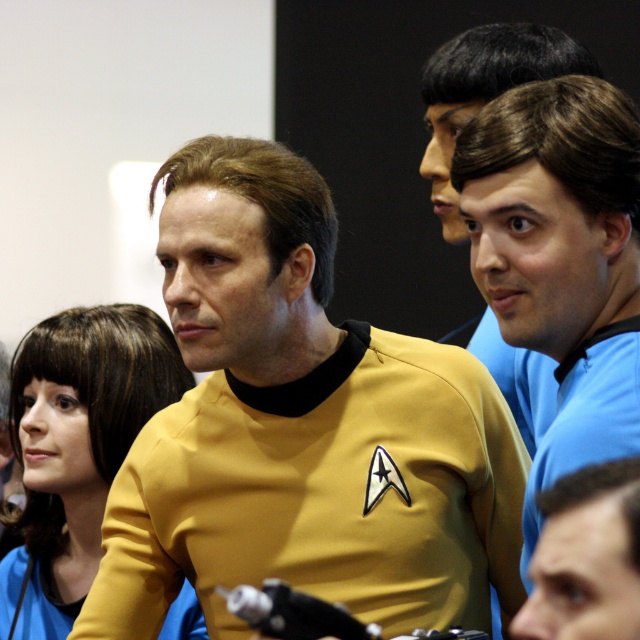
Question: Can you confirm if blue smooth shirt at right is wider than matte blue shirt at lower right?

Choices:
 (A) no
 (B) yes

Answer: (B)

Question: Which object is farther from the camera taking this photo?

Choices:
 (A) blue smooth shirt at right
 (B) matte blue shirt at lower right

Answer: (A)

Question: Considering the real-world distances, which object is closest to the matte blue shirt at lower right?

Choices:
 (A) yellow matte uniform at center
 (B) blue smooth shirt at right

Answer: (B)

Question: Is yellow matte uniform at center to the right of matte blue shirt at lower right from the viewer's perspective?

Choices:
 (A) yes
 (B) no

Answer: (B)

Question: Is yellow matte uniform at center wider than blue smooth shirt at right?

Choices:
 (A) no
 (B) yes

Answer: (B)

Question: Which of the following is the farthest from the observer?

Choices:
 (A) (134, 614)
 (B) (609, 348)
 (C) (552, 636)

Answer: (A)